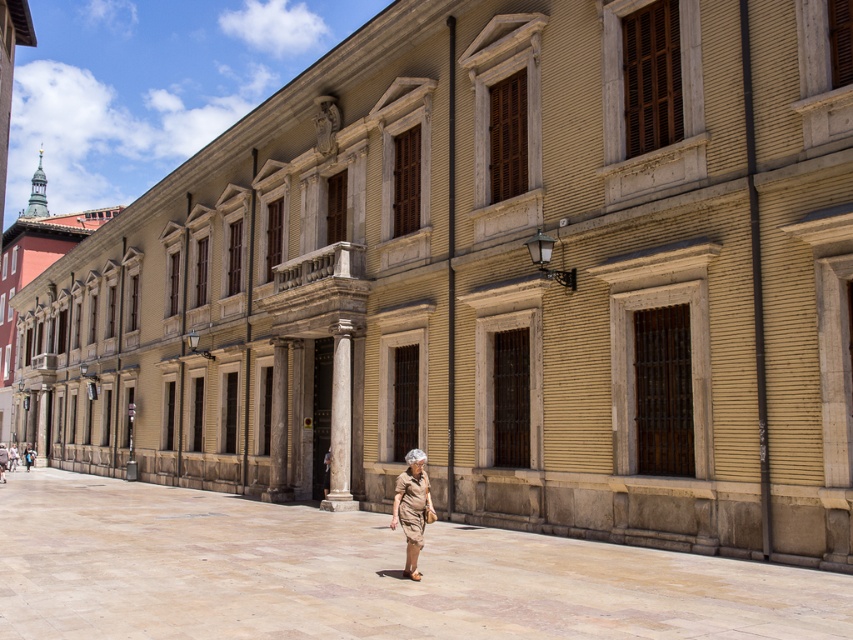
Question: Is brown fabric trench coat at lower center to the left of light brown leather jacket at center from the viewer's perspective?

Choices:
 (A) yes
 (B) no

Answer: (B)

Question: Which point is farther from the camera taking this photo?

Choices:
 (A) (347, 392)
 (B) (6, 465)

Answer: (B)

Question: From the image, what is the correct spatial relationship of brown fabric dress at center in relation to khaki cotton shorts at center?

Choices:
 (A) right
 (B) left

Answer: (A)

Question: Which object appears farthest from the camera in this image?

Choices:
 (A) light brown leather jacket at center
 (B) brown fabric trench coat at lower center
 (C) brown fabric dress at center

Answer: (A)

Question: Is brown fabric dress at center below brown fabric trench coat at lower center?

Choices:
 (A) yes
 (B) no

Answer: (A)

Question: Among these points, which one is nearest to the camera?

Choices:
 (A) (15, 465)
 (B) (3, 445)

Answer: (A)